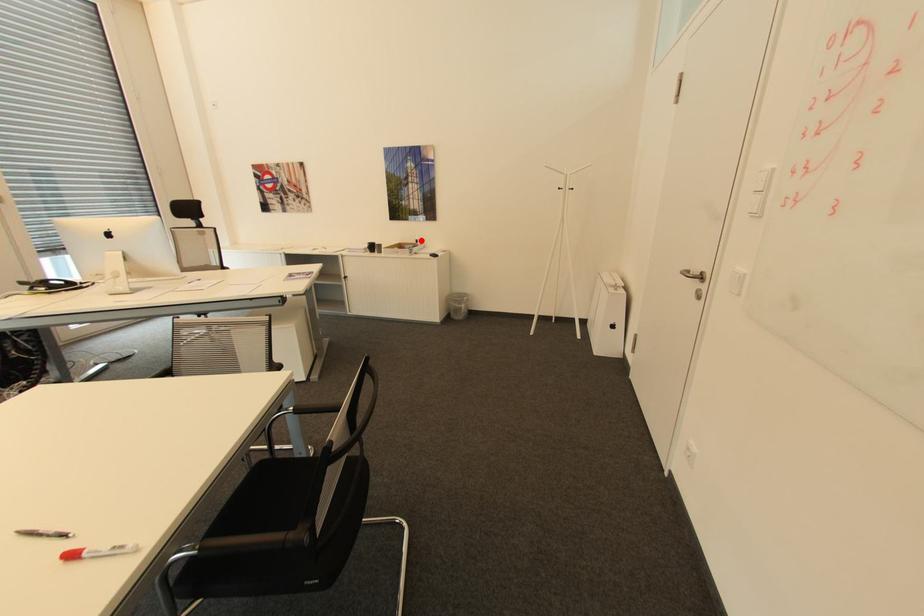
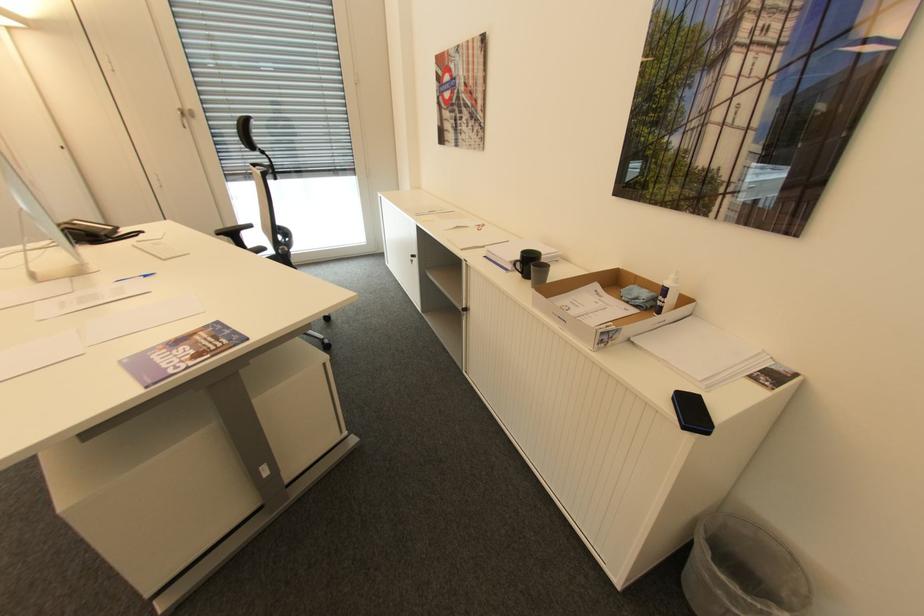
Where in the second image is the point corresponding to the highlighted location from the first image?

(670, 291)